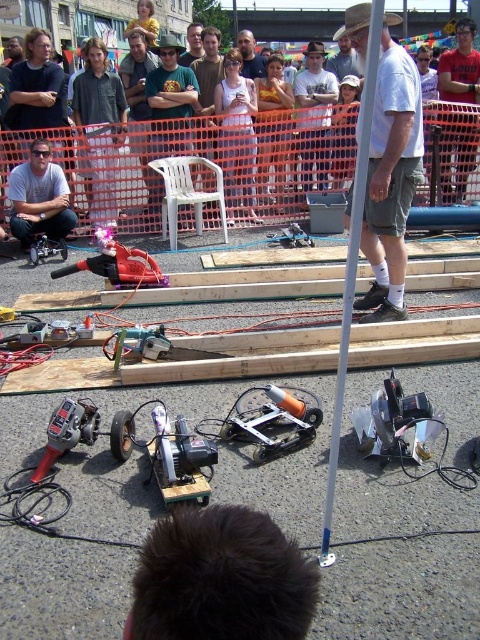
Looking at this image, who is more forward, (222, 163) or (285, 397)?

Positioned in front is point (285, 397).

Is matte black clothing at upper center behind metallic silver robot at center?

Yes, it is.

Is point (29, 138) positioned after point (239, 428)?

Yes, it is behind point (239, 428).

Where is `matte black clothing at upper center`? The height and width of the screenshot is (640, 480). matte black clothing at upper center is located at coordinates (210, 157).

From the picture: Measure the distance from white plastic pole at center to matte black shirt at center.

Result: white plastic pole at center is 12.23 meters from matte black shirt at center.

Who is lower down, white plastic pole at center or matte black shirt at center?

Positioned lower is white plastic pole at center.

Does point (336, 396) come behind point (188, 35)?

No, (336, 396) is in front of (188, 35).

Where is `white plastic pole at center`? The height and width of the screenshot is (640, 480). white plastic pole at center is located at coordinates (349, 282).

Between white plastic pole at center and matte black shirt at left, which one has more height?

Standing taller between the two is matte black shirt at left.

Based on the photo, is white plastic pole at center positioned in front of matte black shirt at left?

Yes, white plastic pole at center is in front of matte black shirt at left.

Is point (347, 284) positioned behind point (34, 234)?

No, it is in front of (34, 234).

At what (x,y) coordinates should I click in order to perform the action: click on white plastic pole at center. Please return your answer as a coordinate pair (x, y). This screenshot has width=480, height=640. Looking at the image, I should click on (349, 282).